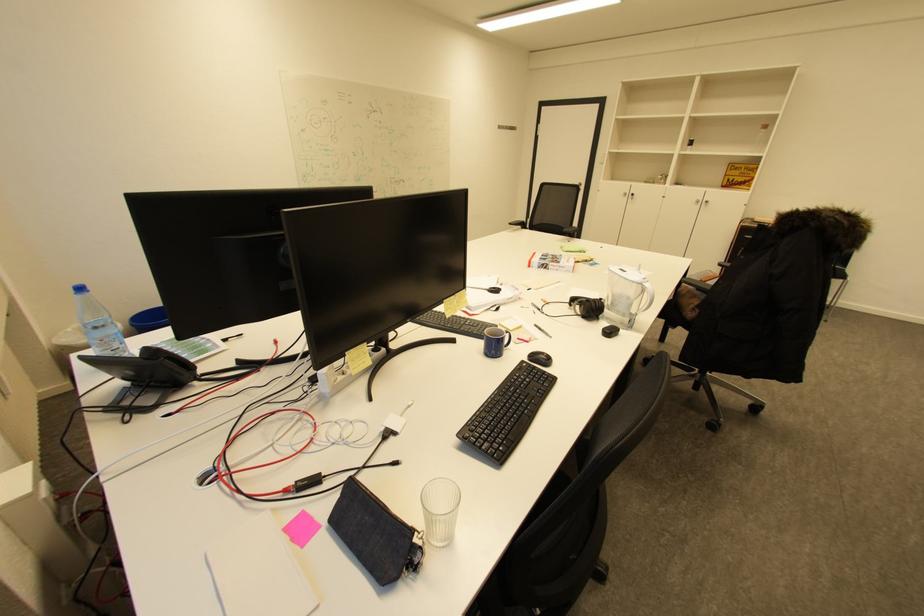
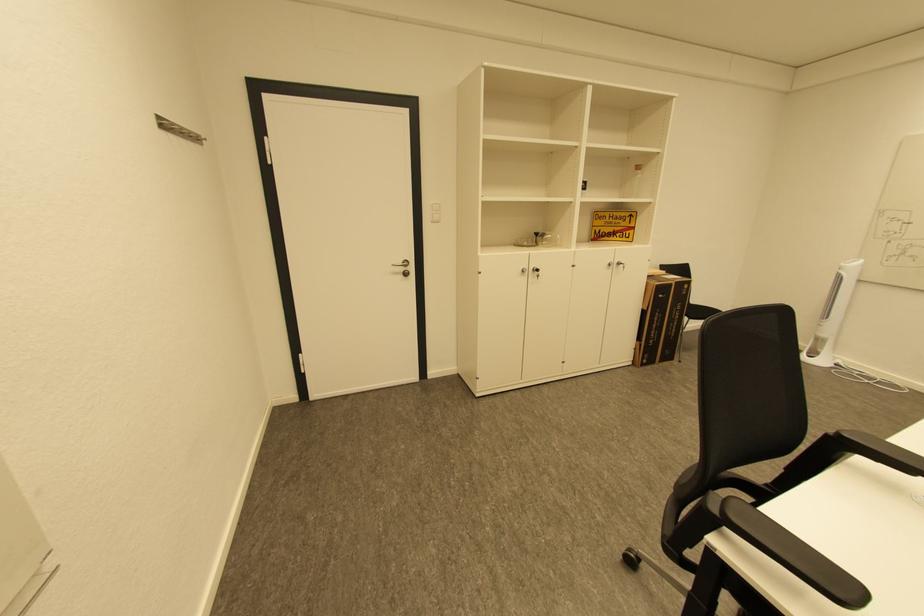
Find the pixel in the second image that matches point (505, 131) in the first image.

(169, 132)